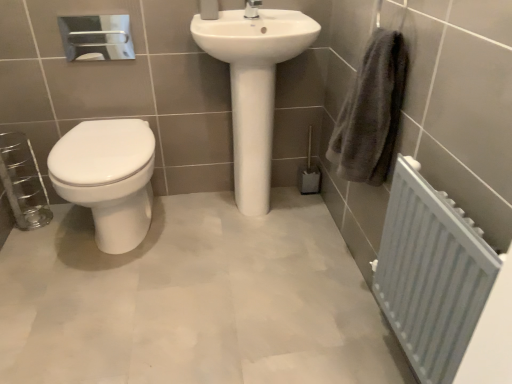
The width and height of the screenshot is (512, 384). In order to click on vacant space that is to the left of polished chrome tap at upper center in this screenshot , I will do `click(222, 16)`.